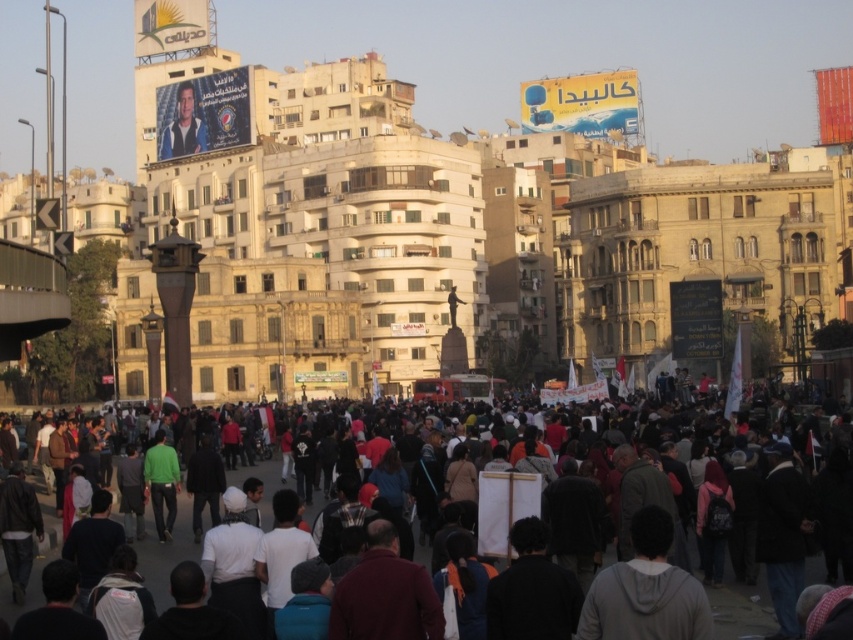
You are a photographer trying to capture a candid shot of the dark gray clothing at center and the silhouette figure at center. If you want to ensure both subjects are in focus, which one should you adjust your camera focus to prioritize based on their sizes?

The dark gray clothing at center is wider than the silhouette figure at center, so you should prioritize focusing on the dark gray clothing at center since it is larger and may require more precise focus to capture details.

You are a city planner analyzing the urban scene. You need to locate the matte black poster at upper left. Where exactly is it positioned in terms of coordinates?

The matte black poster at upper left is positioned at coordinates point [183,128].